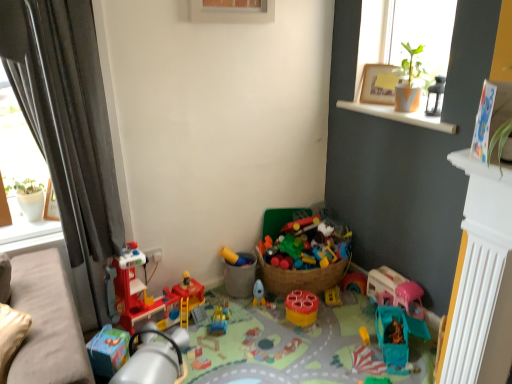
Question: From the image's perspective, relative to plastic construction set at center, the third toy when ordered from right to left, is white plastic radiator at lower right above or below?

Choices:
 (A) below
 (B) above

Answer: (B)

Question: Is white plastic radiator at lower right bigger or smaller than plastic construction set at center, placed as the 5th toy when sorted from left to right?

Choices:
 (A) small
 (B) big

Answer: (A)

Question: Which of these objects is positioned closest to the matte yellow plastic toy at center, acting as the fourth toy starting from the left?

Choices:
 (A) wooden frame at upper right
 (B) translucent plastic slide at center, which is the second toy from left to right
 (C) white wood window sill at upper right
 (D) white plastic radiator at lower right
 (E) plastic construction set at center, placed as the 5th toy when sorted from left to right

Answer: (B)

Question: Which object is positioned farthest from the gray fabric curtain at left?

Choices:
 (A) white plastic radiator at lower right
 (B) matte yellow plastic toy at center, which ranks as the 4th toy in right-to-left order
 (C) matte plastic cup at center, which is the 2th toy in right-to-left order
 (D) beige fabric couch at lower left
 (E) white wood window sill at upper right

Answer: (A)